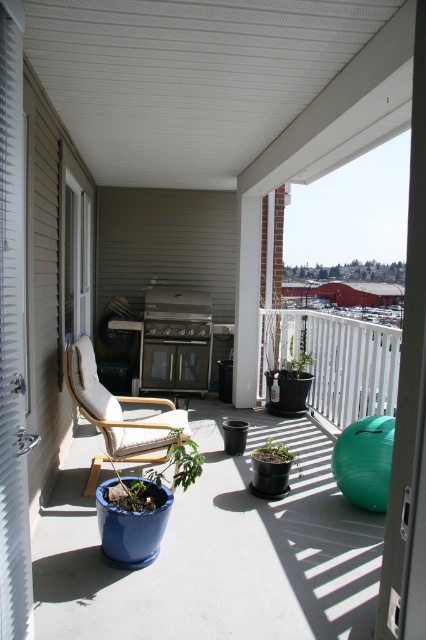
Who is taller, matte white chair at left or white fabric armchair at center?

Standing taller between the two is matte white chair at left.

Measure the distance between matte white chair at left and camera.

matte white chair at left is 2.23 meters away from camera.

Measure the distance between matte white chair at left and camera.

matte white chair at left is 7.33 feet away from camera.

What are the coordinates of `matte white chair at left` in the screenshot? It's located at (236, 522).

Which is behind, point (371, 340) or point (184, 307)?

The point (184, 307) is more distant.

Which is behind, point (215, 516) or point (199, 333)?

The point (199, 333) is more distant.

Find the location of a particular element. The height and width of the screenshot is (640, 426). matte white chair at left is located at coordinates (236, 522).

Who is higher up, matte white chair at left or green matte plant at center?

matte white chair at left is higher up.

Is matte white chair at left positioned behind green matte plant at center?

No.

Who is more distant from viewer, (316,518) or (268,451)?

The point (268,451) is more distant.

Where is `matte white chair at left`? This screenshot has width=426, height=640. matte white chair at left is located at coordinates (236, 522).